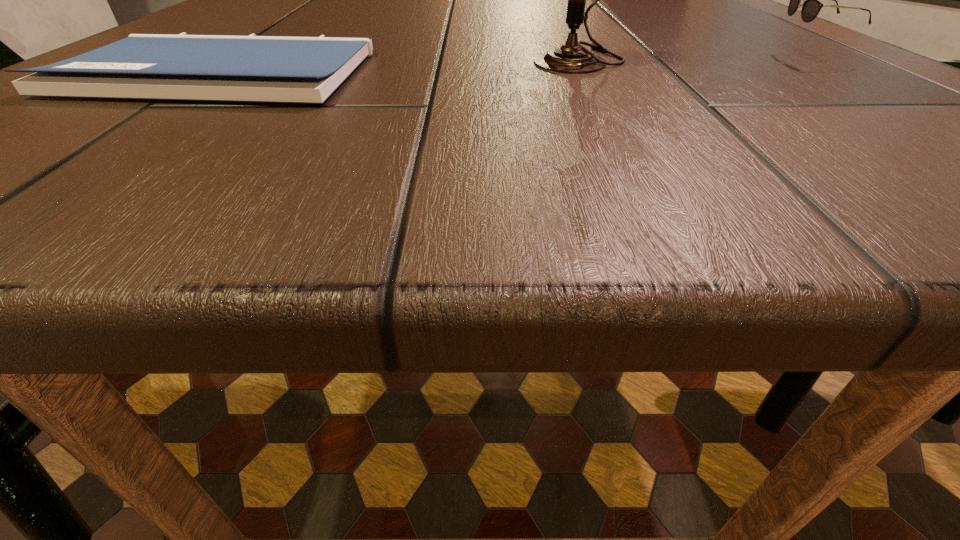
At what (x,y) coordinates should I click in order to perform the action: click on vacant space that is in between the second object from left to right and the rightmost object. Please return your answer as a coordinate pair (x, y). Looking at the image, I should click on (692, 59).

Image resolution: width=960 pixels, height=540 pixels. I want to click on free area in between the shortest object and the second object from right to left, so click(x=400, y=67).

Select which object appears as the second closest to the tallest object. Please provide its 2D coordinates. Your answer should be formatted as a tuple, i.e. [(x, y)], where the tuple contains the x and y coordinates of a point satisfying the conditions above.

[(243, 68)]

I want to click on object that is the second closest one to the microphone, so click(x=243, y=68).

Locate an element on the screen. blank area in the image that satisfies the following two spatial constraints: 1. on the front-facing side of the microphone; 2. on the front side of the leftmost object is located at coordinates (587, 73).